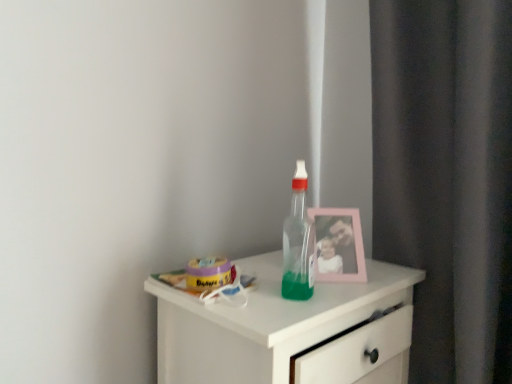
Question: Can you confirm if pink plastic picture frame at upper right is positioned to the right of transparent plastic bottle at center?

Choices:
 (A) yes
 (B) no

Answer: (A)

Question: Does pink plastic picture frame at upper right lie in front of transparent plastic bottle at center?

Choices:
 (A) no
 (B) yes

Answer: (A)

Question: Are pink plastic picture frame at upper right and transparent plastic bottle at center beside each other?

Choices:
 (A) yes
 (B) no

Answer: (A)

Question: Is pink plastic picture frame at upper right wider than transparent plastic bottle at center?

Choices:
 (A) no
 (B) yes

Answer: (B)

Question: Is pink plastic picture frame at upper right facing towards transparent plastic bottle at center?

Choices:
 (A) no
 (B) yes

Answer: (B)

Question: Looking at the image, does pink plastic picture frame at upper right seem bigger or smaller compared to transparent plastic bottle at center?

Choices:
 (A) big
 (B) small

Answer: (A)

Question: Would you say pink plastic picture frame at upper right is inside or outside transparent plastic bottle at center?

Choices:
 (A) inside
 (B) outside

Answer: (B)

Question: From the image's perspective, relative to transparent plastic bottle at center, is pink plastic picture frame at upper right above or below?

Choices:
 (A) below
 (B) above

Answer: (A)

Question: In terms of height, does pink plastic picture frame at upper right look taller or shorter compared to transparent plastic bottle at center?

Choices:
 (A) short
 (B) tall

Answer: (A)

Question: Would you say transparent plastic bottle at center is to the left or to the right of white glossy chest of drawers at center in the picture?

Choices:
 (A) left
 (B) right

Answer: (B)

Question: Considering the positions of transparent plastic bottle at center and white glossy chest of drawers at center in the image, is transparent plastic bottle at center taller or shorter than white glossy chest of drawers at center?

Choices:
 (A) short
 (B) tall

Answer: (A)

Question: Looking at their shapes, would you say transparent plastic bottle at center is wider or thinner than white glossy chest of drawers at center?

Choices:
 (A) wide
 (B) thin

Answer: (B)

Question: From the image's perspective, is transparent plastic bottle at center located above or below white glossy chest of drawers at center?

Choices:
 (A) below
 (B) above

Answer: (B)

Question: Considering the positions of white glossy chest of drawers at center and transparent plastic bottle at center in the image, is white glossy chest of drawers at center taller or shorter than transparent plastic bottle at center?

Choices:
 (A) tall
 (B) short

Answer: (A)

Question: Looking at the image, does white glossy chest of drawers at center seem bigger or smaller compared to transparent plastic bottle at center?

Choices:
 (A) small
 (B) big

Answer: (B)